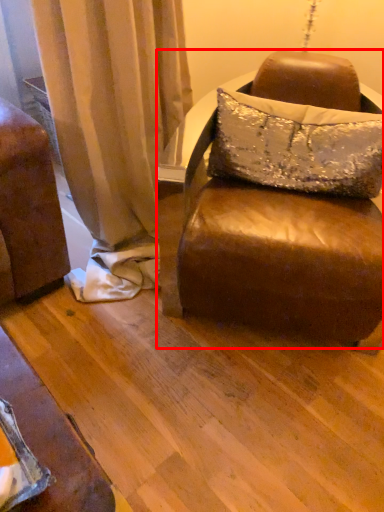
Question: From the image's perspective, considering the relative positions of studio couch (annotated by the red box) and pillow in the image provided, where is studio couch (annotated by the red box) located with respect to the staircase?

Choices:
 (A) below
 (B) above

Answer: (A)